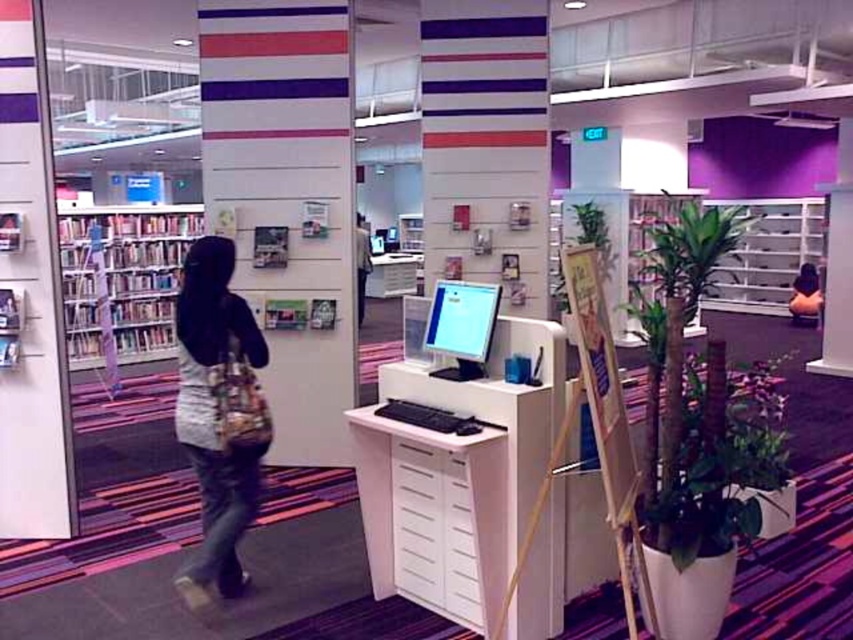
Question: Among these objects, which one is farthest from the camera?

Choices:
 (A) wooden easel at center
 (B) denim jeans at left

Answer: (B)

Question: Considering the real-world distances, which object is farthest from the white glossy file cabinet at center?

Choices:
 (A) matte black computer at center
 (B) satin silver monitor at center

Answer: (A)

Question: Is denim jeans at left further to the viewer compared to matte black monitor at center?

Choices:
 (A) yes
 (B) no

Answer: (A)

Question: Can you confirm if white glossy pillar at center is positioned to the left of matte black monitor at center?

Choices:
 (A) no
 (B) yes

Answer: (B)

Question: Which point is closer to the camera?

Choices:
 (A) matte black monitor at center
 (B) wooden bookshelf at left
 (C) satin silver monitor at center

Answer: (A)

Question: Is white glossy file cabinet at center further to the viewer compared to satin silver monitor at center?

Choices:
 (A) no
 (B) yes

Answer: (A)